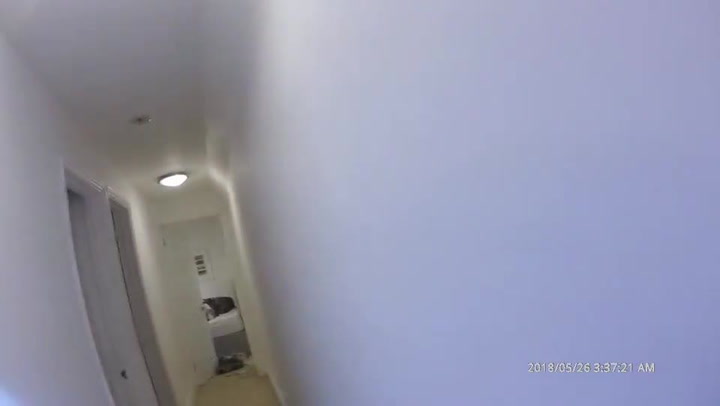
Where is `doorways`? doorways is located at coordinates (78, 214), (81, 265), (107, 305), (120, 366), (119, 208), (132, 253), (132, 290), (153, 332), (166, 369).